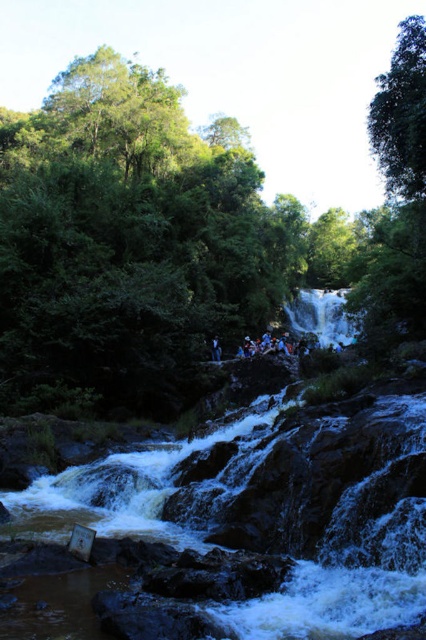
Question: Is brown rocky creek at center below dark blue fabric person at center?

Choices:
 (A) yes
 (B) no

Answer: (A)

Question: Is brown rocky creek at center positioned behind dark blue fabric person at center?

Choices:
 (A) no
 (B) yes

Answer: (A)

Question: Which object appears farthest from the camera in this image?

Choices:
 (A) white smooth waterfall at center
 (B) dark blue fabric person at center
 (C) brown rocky creek at center

Answer: (B)

Question: Which of the following is the farthest from the observer?

Choices:
 (A) (354, 326)
 (B) (362, 492)
 (C) (218, 353)

Answer: (A)

Question: Which object appears closest to the camera in this image?

Choices:
 (A) dark blue fabric person at center
 (B) brown rocky creek at center

Answer: (B)

Question: Can you confirm if brown rocky creek at center is bigger than white smooth waterfall at center?

Choices:
 (A) yes
 (B) no

Answer: (B)